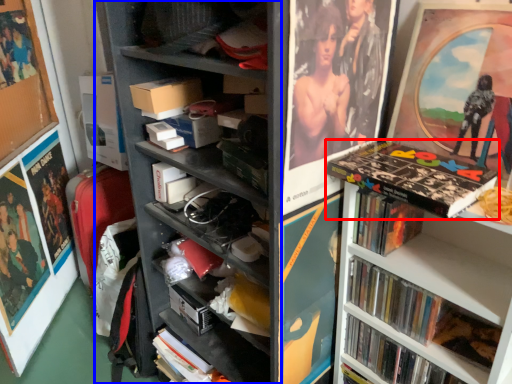
Question: Which object appears closest to the camera in this image, book (highlighted by a red box) or bookshelf (highlighted by a blue box)?

Choices:
 (A) book
 (B) bookshelf

Answer: (B)